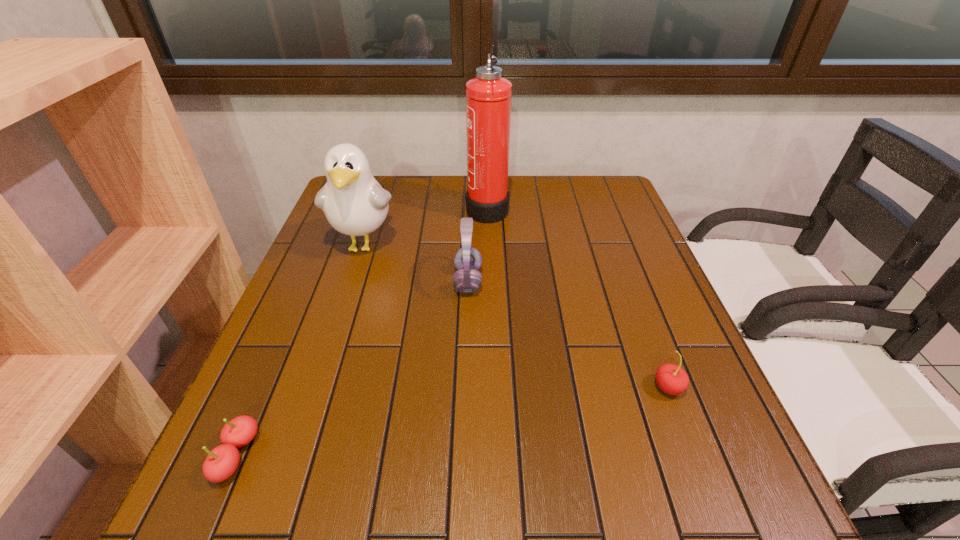
Where is `free spot at the far edge of the desktop`? The height and width of the screenshot is (540, 960). free spot at the far edge of the desktop is located at coordinates (524, 198).

The height and width of the screenshot is (540, 960). What are the coordinates of `blank space at the near edge of the desktop` in the screenshot? It's located at (489, 522).

In the image, there is a desktop. Where is `free space at the right edge`? Image resolution: width=960 pixels, height=540 pixels. free space at the right edge is located at coordinates (616, 227).

In the image, there is a desktop. In order to click on free space at the far left corner in this screenshot , I will do `click(375, 178)`.

This screenshot has width=960, height=540. Identify the location of vacant space at the near left corner. (237, 496).

Locate an element on the screen. Image resolution: width=960 pixels, height=540 pixels. free region at the far right corner of the desktop is located at coordinates (588, 180).

Where is `free space between the left cherry and the taller cherry`? free space between the left cherry and the taller cherry is located at coordinates (453, 422).

You are a GUI agent. You are given a task and a screenshot of the screen. Output one action in this format:
    pyautogui.click(x=<x>, y=<y>)
    Task: Click on the vacant space in between the gull and the headset
    
    Given the screenshot: What is the action you would take?
    pyautogui.click(x=416, y=263)

The image size is (960, 540). In order to click on free area in between the headset and the tallest object in this screenshot , I will do `click(478, 244)`.

Where is `vacant region between the gull and the second nearest object`? This screenshot has height=540, width=960. vacant region between the gull and the second nearest object is located at coordinates (516, 316).